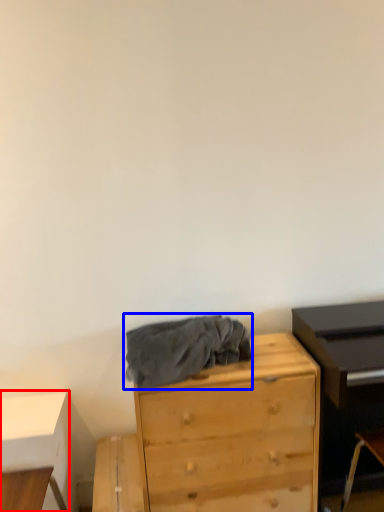
Question: Which of the following is the farthest to the observer, table (highlighted by a red box) or clothing (highlighted by a blue box)?

Choices:
 (A) table
 (B) clothing

Answer: (A)